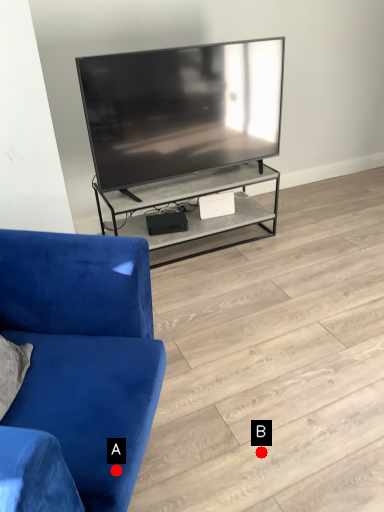
Question: Two points are circled on the image, labeled by A and B beside each circle. Which point is closer to the camera?

Choices:
 (A) A is closer
 (B) B is closer

Answer: (A)